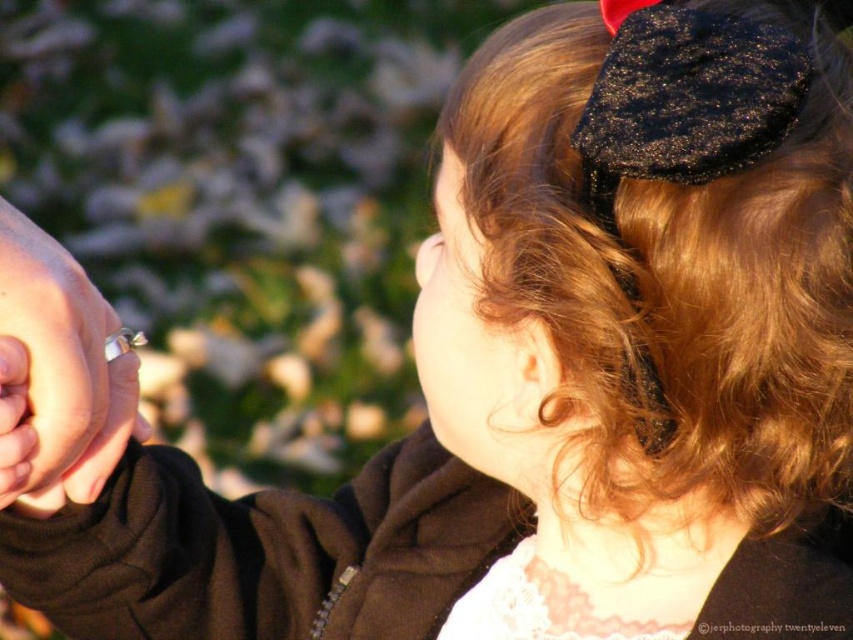
What do you see at coordinates (672, 285) in the screenshot? I see `shiny brown hair at upper right` at bounding box center [672, 285].

Is point (759, 77) positioned behind point (0, 404)?

Yes, point (759, 77) is farther from viewer.

The image size is (853, 640). In order to click on shiny brown hair at upper right in this screenshot , I will do `click(672, 285)`.